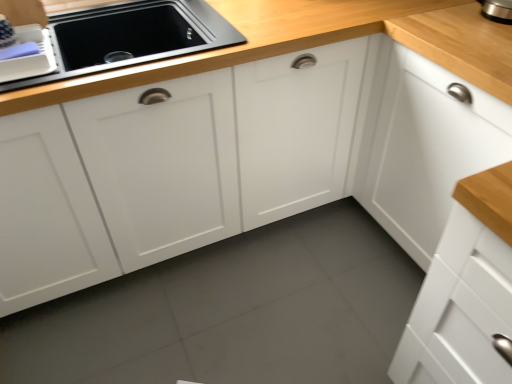
Question: From a real-world perspective, is matte black sink at upper left physically above matte plastic dish rack at upper left?

Choices:
 (A) no
 (B) yes

Answer: (A)

Question: Does matte black sink at upper left have a lesser width compared to matte plastic dish rack at upper left?

Choices:
 (A) yes
 (B) no

Answer: (B)

Question: Does matte black sink at upper left have a greater width compared to matte plastic dish rack at upper left?

Choices:
 (A) yes
 (B) no

Answer: (A)

Question: From a real-world perspective, is matte black sink at upper left physically below matte plastic dish rack at upper left?

Choices:
 (A) yes
 (B) no

Answer: (A)

Question: Can you confirm if matte black sink at upper left is smaller than matte plastic dish rack at upper left?

Choices:
 (A) yes
 (B) no

Answer: (B)

Question: Are matte black sink at upper left and matte plastic dish rack at upper left beside each other?

Choices:
 (A) yes
 (B) no

Answer: (B)

Question: Is matte plastic dish rack at upper left shorter than matte black sink at upper left?

Choices:
 (A) yes
 (B) no

Answer: (A)

Question: Can matte black sink at upper left be found inside matte plastic dish rack at upper left?

Choices:
 (A) no
 (B) yes

Answer: (A)

Question: Is matte plastic dish rack at upper left positioned beyond the bounds of matte black sink at upper left?

Choices:
 (A) no
 (B) yes

Answer: (B)

Question: Could you tell me if matte plastic dish rack at upper left is facing matte black sink at upper left?

Choices:
 (A) no
 (B) yes

Answer: (A)

Question: From the image's perspective, is matte plastic dish rack at upper left over matte black sink at upper left?

Choices:
 (A) no
 (B) yes

Answer: (B)

Question: Is the position of matte plastic dish rack at upper left more distant than that of matte black sink at upper left?

Choices:
 (A) no
 (B) yes

Answer: (A)

Question: Does white matte cabinet at upper right have a lesser width compared to matte black sink at upper left?

Choices:
 (A) no
 (B) yes

Answer: (A)